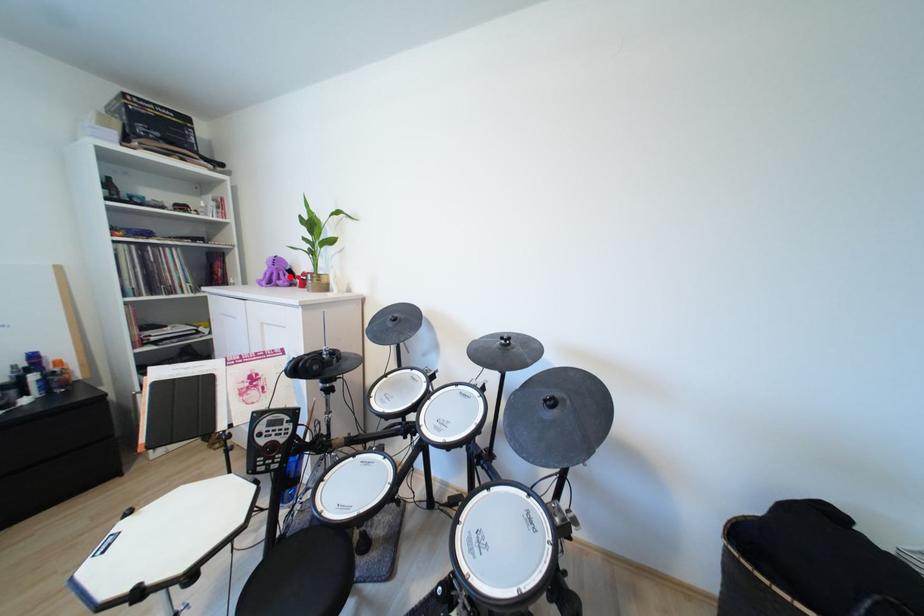
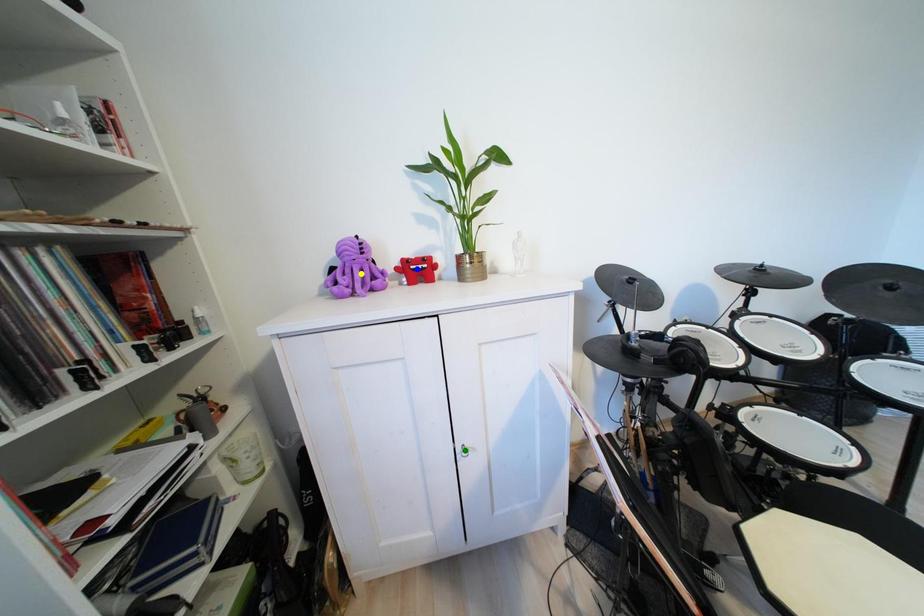
Question: I am providing you with two images of the same scene from different viewpoints. A red point is marked on the first image. You are given multiple points on the second image. Which mark in image 2 goes with the point in image 1?

Choices:
 (A) green point
 (B) yellow point
 (C) blue point

Answer: (B)